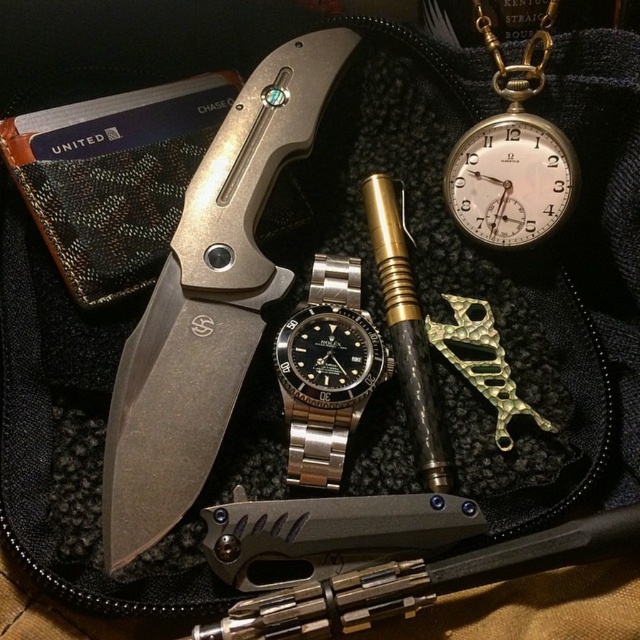
Question: Can you confirm if matte silver knife at upper left is thinner than gold textured fish-shaped pendant at center-right?

Choices:
 (A) no
 (B) yes

Answer: (A)

Question: Which object is farther from the camera taking this photo?

Choices:
 (A) satin steel watch at center
 (B) gold/brass pocket watch at upper right
 (C) gold textured fish-shaped pendant at center-right

Answer: (A)

Question: Considering the real-world distances, which object is farthest from the gold textured fish-shaped pendant at center-right?

Choices:
 (A) satin steel watch at center
 (B) matte silver knife at upper left

Answer: (B)

Question: Does matte silver knife at upper left come behind satin steel watch at center?

Choices:
 (A) yes
 (B) no

Answer: (B)

Question: Among these points, which one is farthest from the camera?

Choices:
 (A) (502, 376)
 (B) (323, 289)
 (C) (182, 348)

Answer: (B)

Question: Is satin steel watch at center closer to camera compared to gold textured fish-shaped pendant at center-right?

Choices:
 (A) no
 (B) yes

Answer: (A)